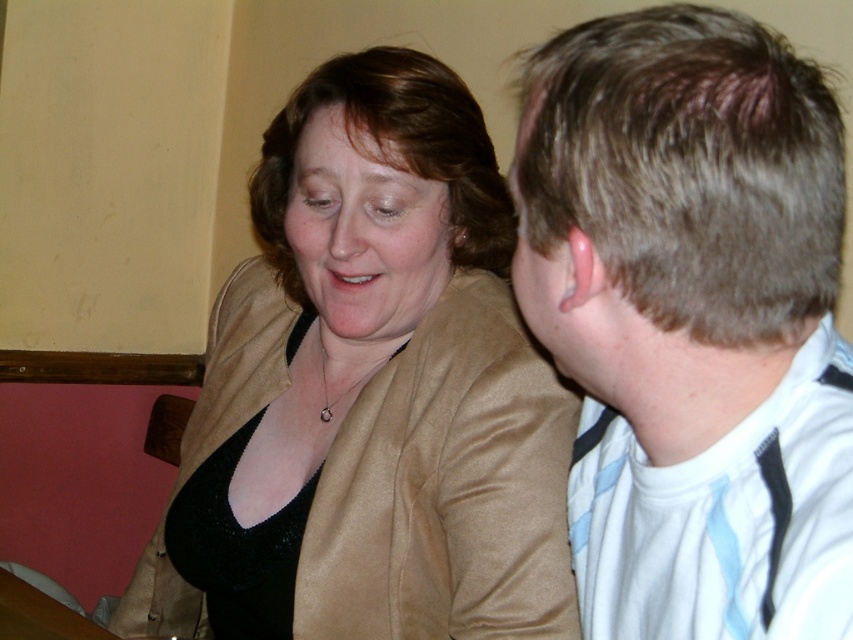
Question: Where is satin gold jacket at upper left located in relation to white striped shirt at right in the image?

Choices:
 (A) right
 (B) left

Answer: (B)

Question: Is satin gold jacket at upper left to the right of white striped shirt at right from the viewer's perspective?

Choices:
 (A) no
 (B) yes

Answer: (A)

Question: Among these points, which one is nearest to the camera?

Choices:
 (A) (480, 522)
 (B) (579, 465)

Answer: (B)

Question: Does satin gold jacket at upper left appear over white striped shirt at right?

Choices:
 (A) yes
 (B) no

Answer: (B)

Question: Which of the following is the farthest from the observer?

Choices:
 (A) (349, 189)
 (B) (741, 406)

Answer: (A)